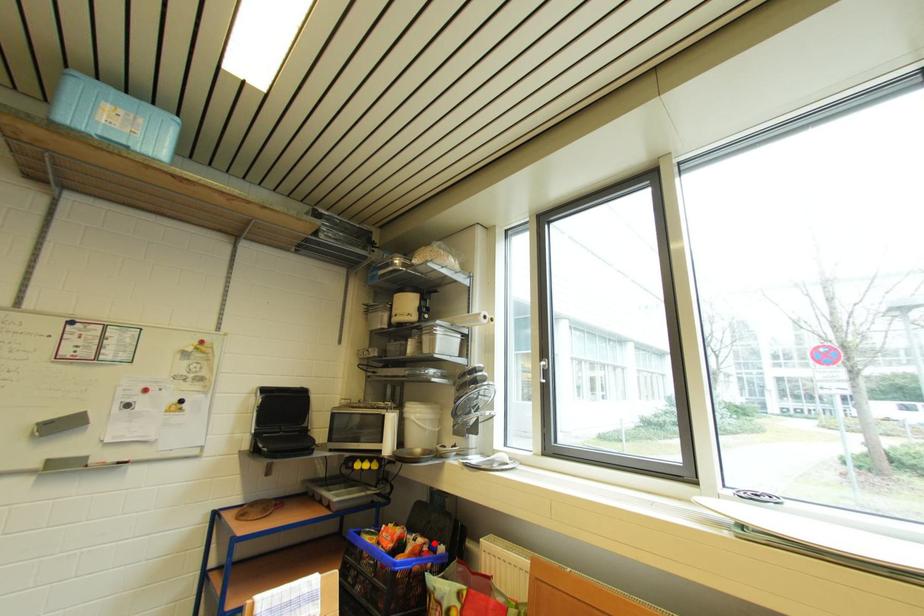
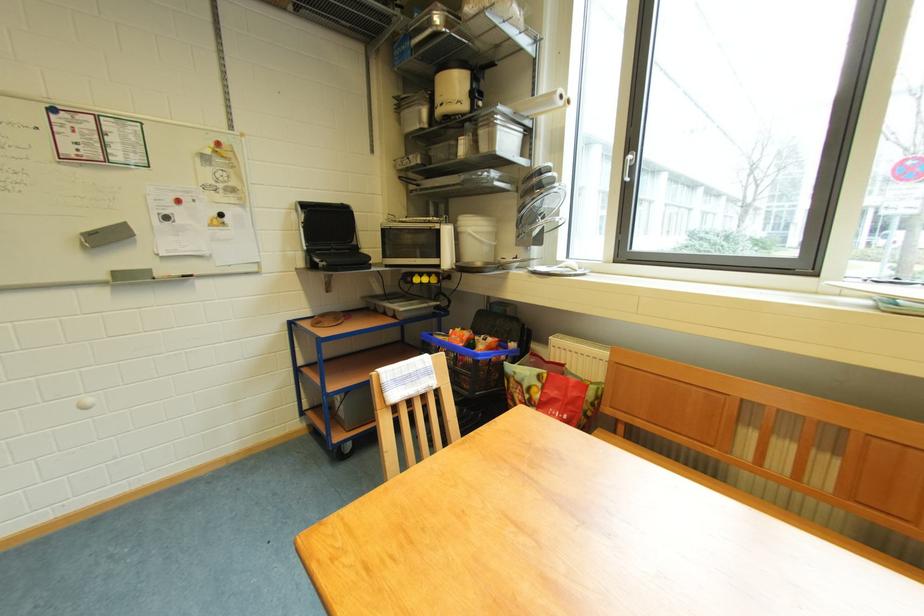
Find the pixel in the second image that matches the highlighted location in the first image.

(504, 342)